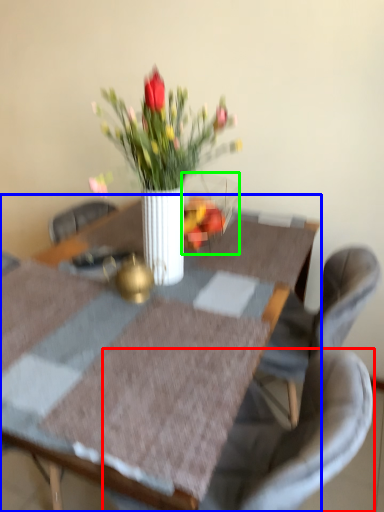
Question: Which object is the closest to the chair (highlighted by a red box)? Choose among these: table (highlighted by a blue box) or glass vase (highlighted by a green box).

Choices:
 (A) table
 (B) glass vase

Answer: (A)